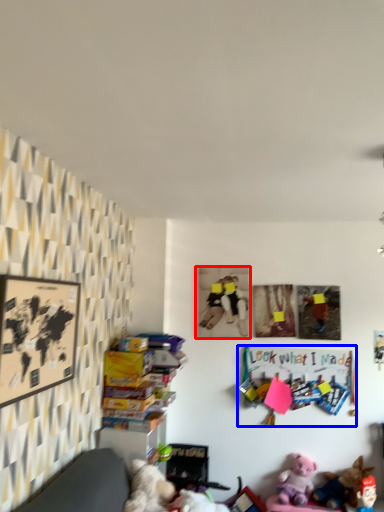
Question: Which object is further to the camera taking this photo, picture frame (highlighted by a red box) or bulletin board (highlighted by a blue box)?

Choices:
 (A) picture frame
 (B) bulletin board

Answer: (A)